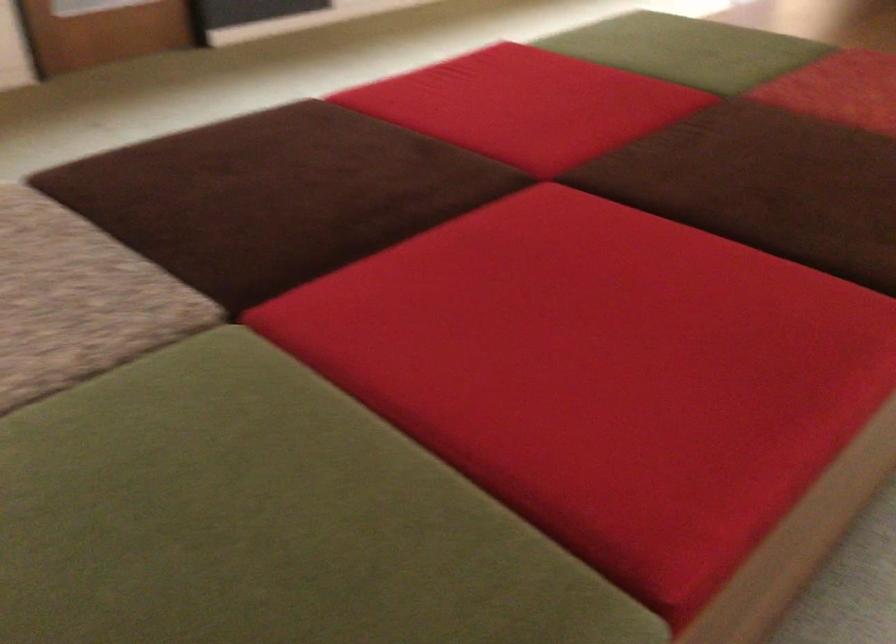
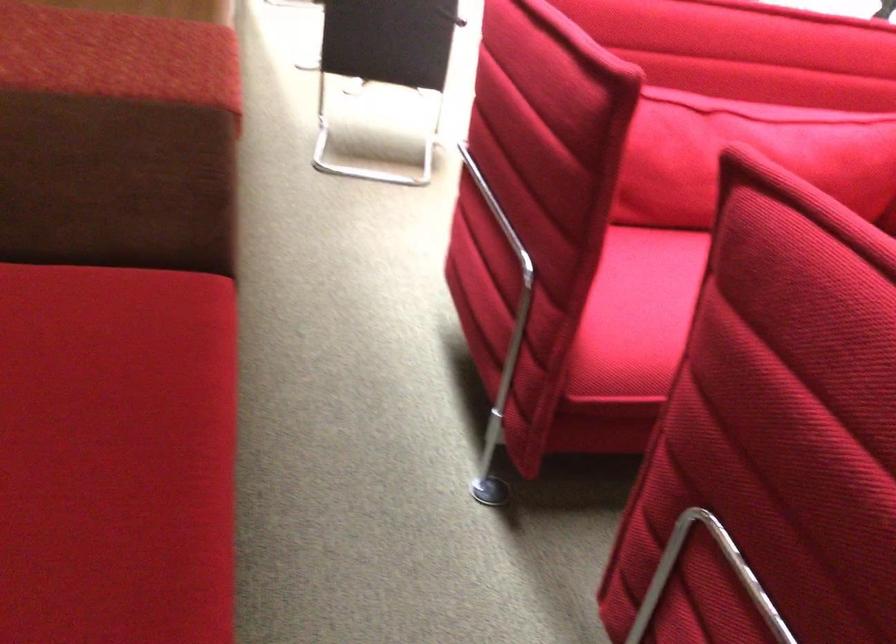
Where in the second image is the point corresponding to [719,422] from the first image?

(116, 455)